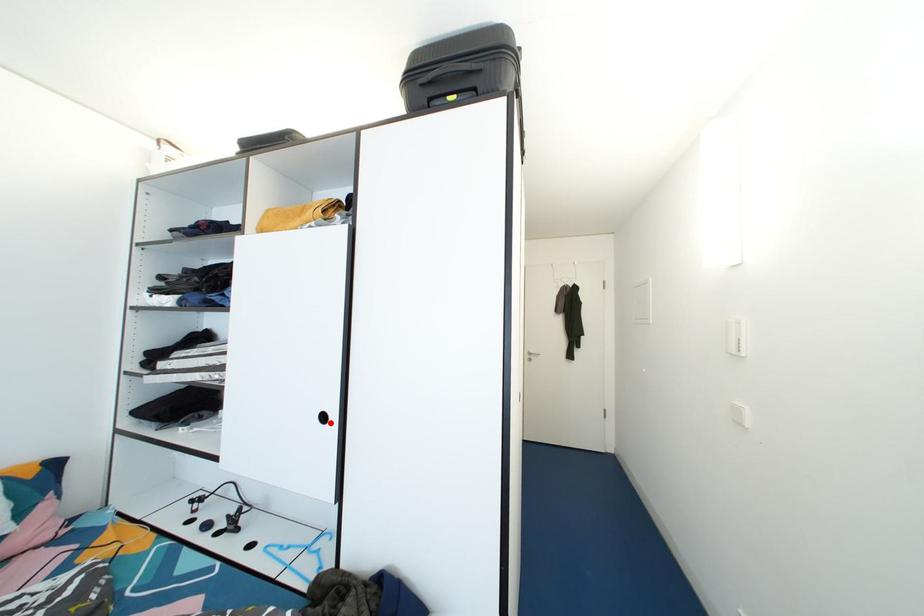
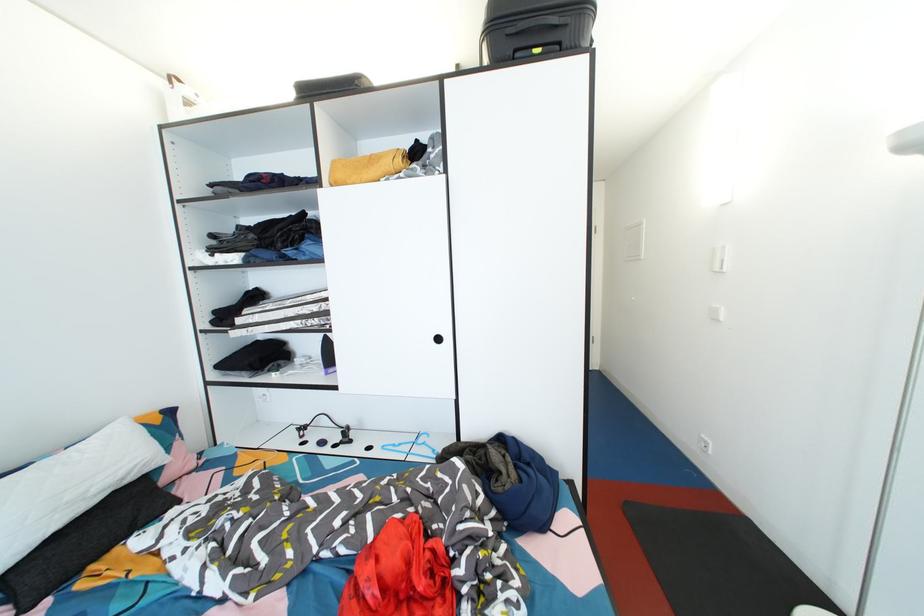
Question: A red point is marked in image1. In image2, is the corresponding 3D point closer to the camera or farther? Reply with the corresponding letter.

Choices:
 (A) The corresponding 3D point is closer.
 (B) The corresponding 3D point is farther.

Answer: (A)